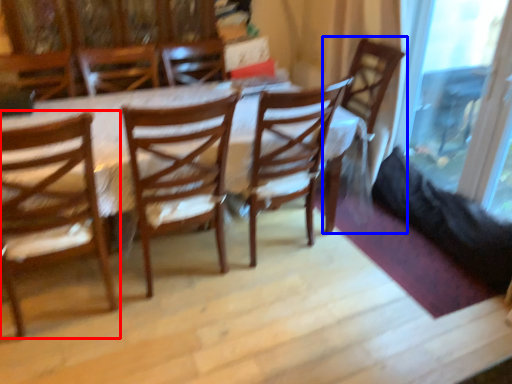
Question: Which object appears farthest to the camera in this image, chair (highlighted by a red box) or chair (highlighted by a blue box)?

Choices:
 (A) chair
 (B) chair

Answer: (B)